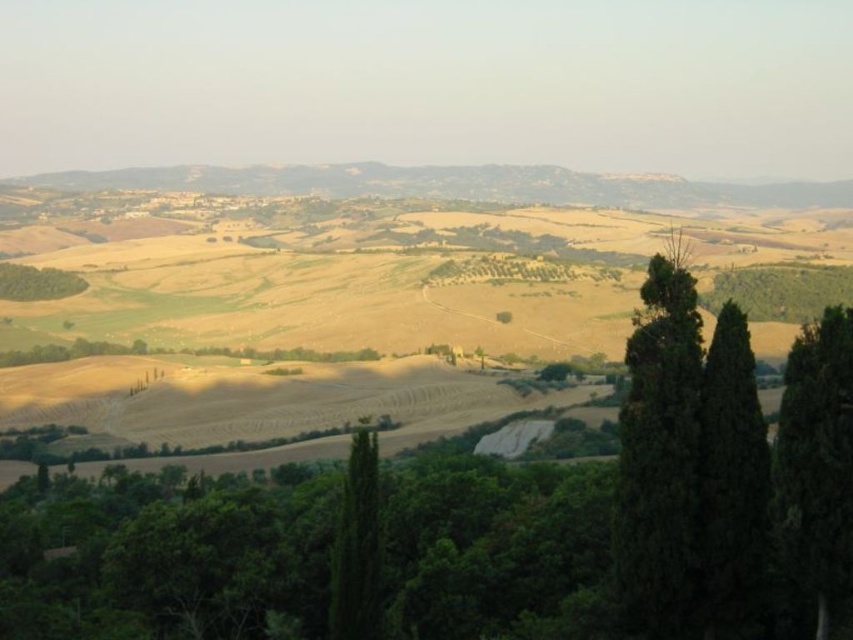
Question: Does green textured tree at center right have a lesser width compared to green leafy tree at lower left?

Choices:
 (A) no
 (B) yes

Answer: (B)

Question: Which object is closer to the camera taking this photo?

Choices:
 (A) green textured tree at center right
 (B) green textured tree at center
 (C) green leafy tree at lower left

Answer: (A)

Question: Can you confirm if green textured tree at center is wider than green leafy tree at lower left?

Choices:
 (A) yes
 (B) no

Answer: (B)

Question: Among these points, which one is farthest from the camera?

Choices:
 (A) (793, 371)
 (B) (376, 612)

Answer: (B)

Question: Which object is farther from the camera taking this photo?

Choices:
 (A) green leafy tree at lower left
 (B) green textured tree at center right
 (C) green textured tree at center

Answer: (A)

Question: Is green textured tree at center right to the left of green leafy tree at lower left from the viewer's perspective?

Choices:
 (A) yes
 (B) no

Answer: (B)